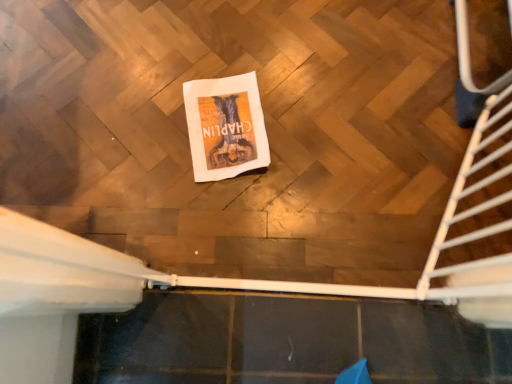
Where is `empty space that is ontop of white paper towel at center (from a real-world perspective)`? This screenshot has height=384, width=512. empty space that is ontop of white paper towel at center (from a real-world perspective) is located at coordinates point(223,122).